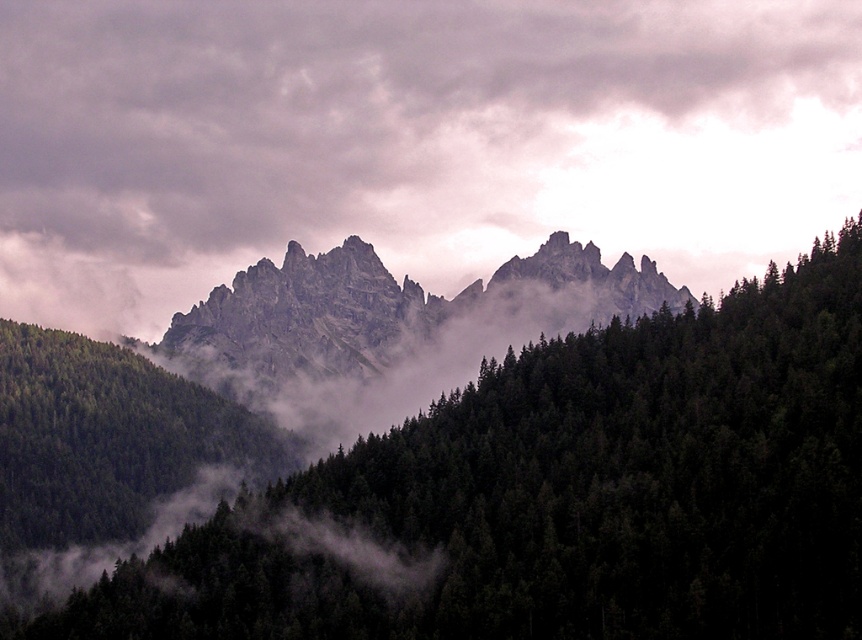
Looking at this image, can you confirm if dark green textured trees at center is wider than rugged stone mountain at center?

No, dark green textured trees at center is not wider than rugged stone mountain at center.

Which is below, dark green textured trees at center or rugged stone mountain at center?

dark green textured trees at center

Does point (479, 556) come behind point (290, 419)?

No, it is not.

Locate an element on the screen. The height and width of the screenshot is (640, 862). dark green textured trees at center is located at coordinates (566, 493).

Is gray cloudy sky at upper center to the right of rugged stone mountain at center from the viewer's perspective?

No, gray cloudy sky at upper center is not to the right of rugged stone mountain at center.

Which is below, gray cloudy sky at upper center or rugged stone mountain at center?

rugged stone mountain at center is below.

Does point (859, 157) come closer to viewer compared to point (556, 246)?

No, (859, 157) is further to viewer.

I want to click on gray cloudy sky at upper center, so click(409, 140).

In the scene shown: Can you confirm if gray cloudy sky at upper center is wider than dark green textured trees at center?

Yes, gray cloudy sky at upper center is wider than dark green textured trees at center.

Does gray cloudy sky at upper center have a lesser width compared to dark green textured trees at center?

Incorrect, gray cloudy sky at upper center's width is not less than dark green textured trees at center's.

Between point (829, 106) and point (725, 570), which one is positioned behind?

Point (829, 106)

Where is `gray cloudy sky at upper center`? The height and width of the screenshot is (640, 862). gray cloudy sky at upper center is located at coordinates (409, 140).